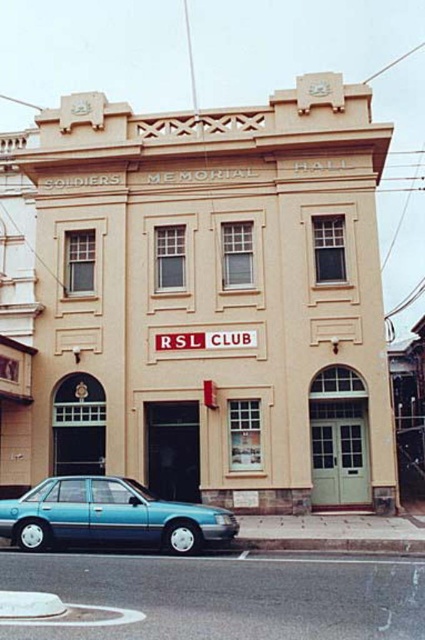
Question: Among these points, which one is farthest from the camera?

Choices:
 (A) (65, 189)
 (B) (365, 628)
 (C) (105, 513)

Answer: (A)

Question: Is beige stone building at center thinner than teal glossy sedan at lower left?

Choices:
 (A) yes
 (B) no

Answer: (B)

Question: Is black asphalt road at lower center to the right of teal glossy sedan at lower left from the viewer's perspective?

Choices:
 (A) yes
 (B) no

Answer: (A)

Question: Does beige stone building at center have a greater width compared to black asphalt road at lower center?

Choices:
 (A) yes
 (B) no

Answer: (A)

Question: Which point is closer to the camera taking this photo?

Choices:
 (A) (345, 611)
 (B) (39, 532)

Answer: (A)

Question: Which point is farther to the camera?

Choices:
 (A) (167, 531)
 (B) (283, 573)

Answer: (A)